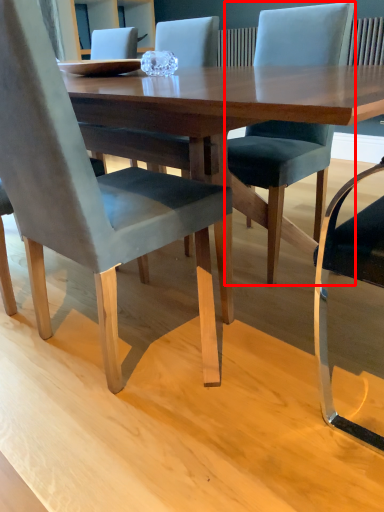
Question: From the image's perspective, what is the correct spatial positioning of chair (annotated by the red box) in reference to chair?

Choices:
 (A) above
 (B) below

Answer: (A)